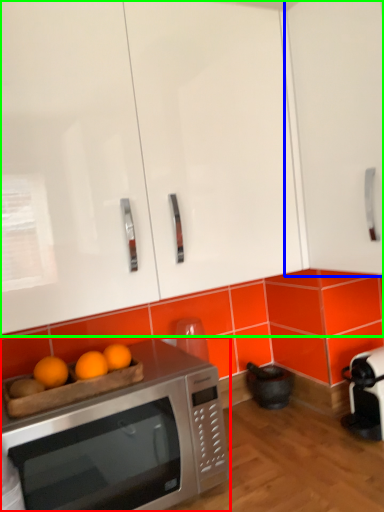
Question: Considering the real-world distances, which object is farthest from microwave oven (highlighted by a red box)? cabinetry (highlighted by a blue box) or cabinetry (highlighted by a green box)?

Choices:
 (A) cabinetry
 (B) cabinetry

Answer: (A)